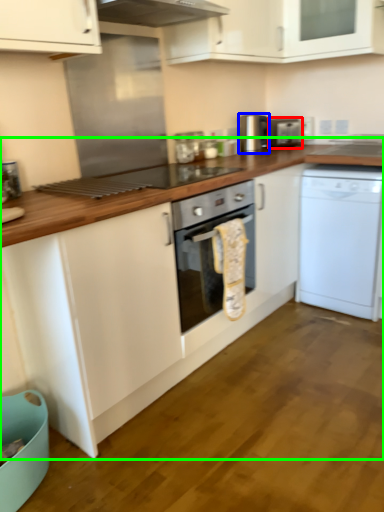
Question: Considering the real-world distances, which object is closest to appliance (highlighted by a red box)? appliance (highlighted by a blue box) or countertop (highlighted by a green box).

Choices:
 (A) appliance
 (B) countertop

Answer: (A)